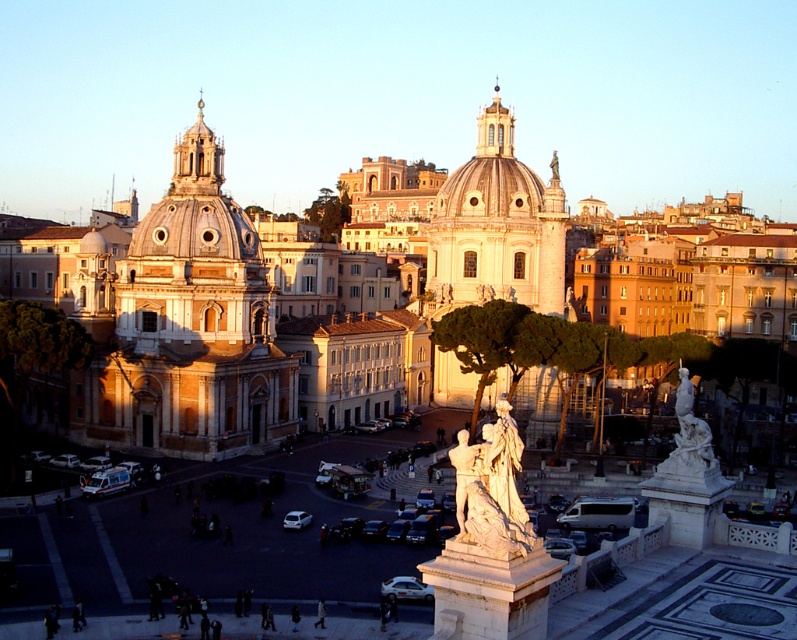
Question: Can you confirm if white marble statue at center is wider than silver metallic sedan at lower center?

Choices:
 (A) yes
 (B) no

Answer: (A)

Question: From the image, what is the correct spatial relationship of silver metallic sedan at lower center in relation to silver metallic car at center?

Choices:
 (A) right
 (B) left

Answer: (A)

Question: Among these objects, which one is nearest to the camera?

Choices:
 (A) white marble statue at center
 (B) white glossy ambulance at lower left

Answer: (A)

Question: Which of these objects is positioned closest to the silver metallic car at lower center?

Choices:
 (A) silver metallic sedan at lower center
 (B) white marble statue at center

Answer: (A)

Question: Is matte stone palace at center above white metallic van at center?

Choices:
 (A) yes
 (B) no

Answer: (A)

Question: Which point is closer to the camera?

Choices:
 (A) (591, 525)
 (B) (89, 477)

Answer: (A)